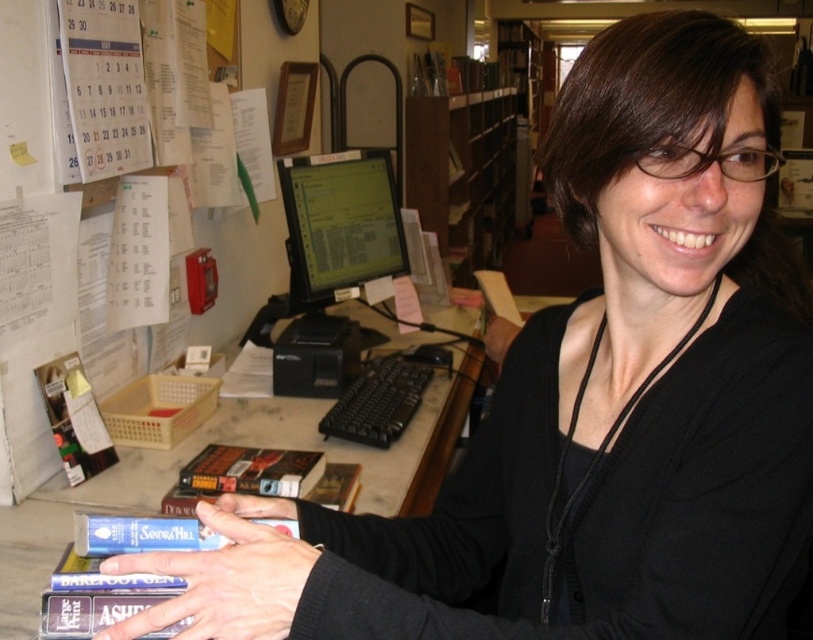
Question: Which object appears farthest from the camera in this image?

Choices:
 (A) black plastic keyboard at center
 (B) wooden bookshelf at upper center

Answer: (B)

Question: In this image, where is wooden bookshelf at upper center located relative to black plastic keyboard at center?

Choices:
 (A) above
 (B) below

Answer: (A)

Question: Does green matte computer monitor at center have a smaller size compared to black plastic keyboard at center?

Choices:
 (A) yes
 (B) no

Answer: (B)

Question: Estimate the real-world distances between objects in this image. Which object is closer to the black plastic keyboard at center?

Choices:
 (A) matte black hand at center
 (B) clear plastic hand at center
 (C) wooden bookshelf at upper center

Answer: (A)

Question: Which point appears farthest from the camera in this image?

Choices:
 (A) (255, 573)
 (B) (359, 164)
 (C) (363, 420)

Answer: (B)

Question: In this image, where is marble desk at center located relative to wooden bookshelf at upper center?

Choices:
 (A) right
 (B) left

Answer: (B)